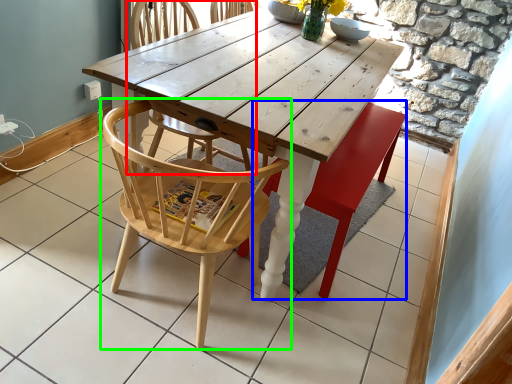
Question: Estimate the real-world distances between objects in this image. Which object is closer to chair (highlighted by a red box), swivel chair (highlighted by a blue box) or chair (highlighted by a green box)?

Choices:
 (A) swivel chair
 (B) chair

Answer: (B)